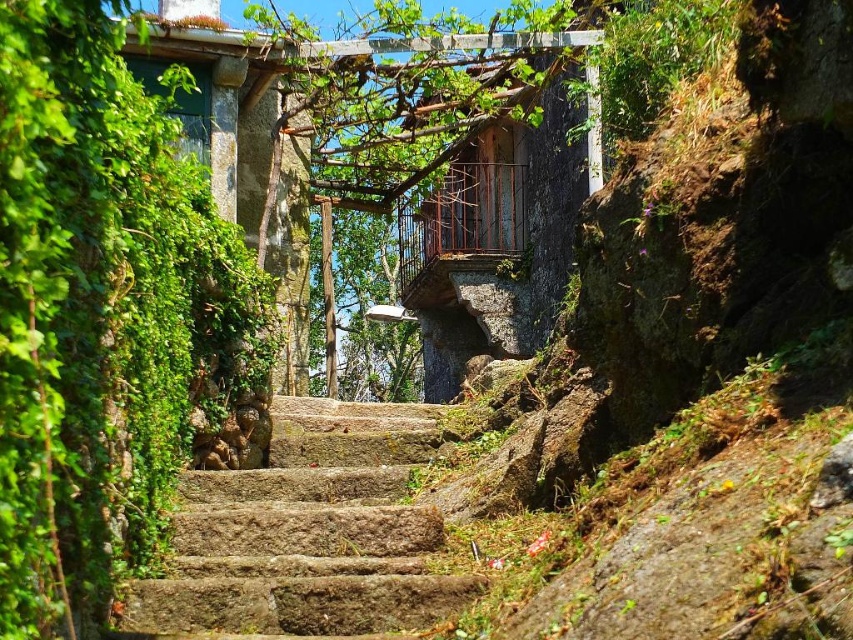
You are standing at the bottom of the staircase and want to take a photo of the green leafy ivy at left and the rusty stone stairs at center. Which object should you focus on first if you want to capture both in the same frame without moving the camera?

You should focus on the rusty stone stairs at center first because the green leafy ivy at left is to the left of it, so keeping the stairs centered will allow both objects to be in the frame.

You are standing at the bottom of the staircase and want to reach the balcony above. Which object, the green leafy ivy at left or the rusty stone stairs at center, would you encounter first as you ascend?

You would encounter the rusty stone stairs at center first because they are closer to the viewer than the green leafy ivy at left, which is farther away.